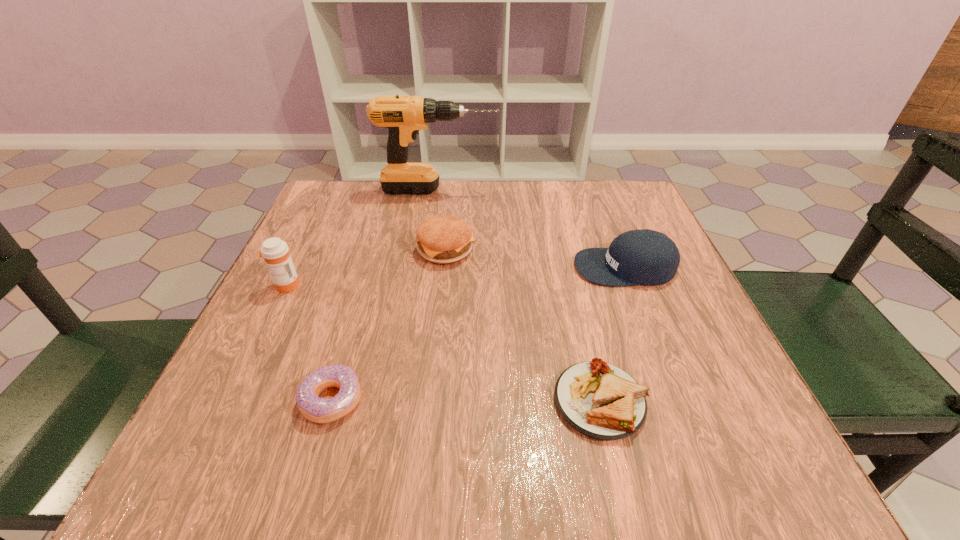
You are a GUI agent. You are given a task and a screenshot of the screen. Output one action in this format:
    pyautogui.click(x=<x>, y=<y>)
    Task: Click on the drill
    
    Given the screenshot: What is the action you would take?
    pyautogui.click(x=404, y=116)

I want to click on the farthest object, so click(x=404, y=116).

Identify the location of the leftmost object. The height and width of the screenshot is (540, 960). (275, 252).

Locate an element on the screen. medicine is located at coordinates (275, 252).

This screenshot has width=960, height=540. I want to click on baseball cap, so click(x=637, y=257).

In order to click on the third shortest object in this screenshot , I will do `click(443, 239)`.

Find the location of a particular element. This screenshot has width=960, height=540. doughnut is located at coordinates (319, 410).

The width and height of the screenshot is (960, 540). I want to click on sandwich, so click(601, 401).

You are a GUI agent. You are given a task and a screenshot of the screen. Output one action in this format:
    pyautogui.click(x=<x>, y=<y>)
    Task: Click on the free spot located at the tip of the farthest object
    The width and height of the screenshot is (960, 540).
    Given the screenshot: What is the action you would take?
    pyautogui.click(x=555, y=190)

Find the location of a particular element. This screenshot has height=540, width=960. vacant space situated 0.230m on the right of the medicine is located at coordinates coord(414,285).